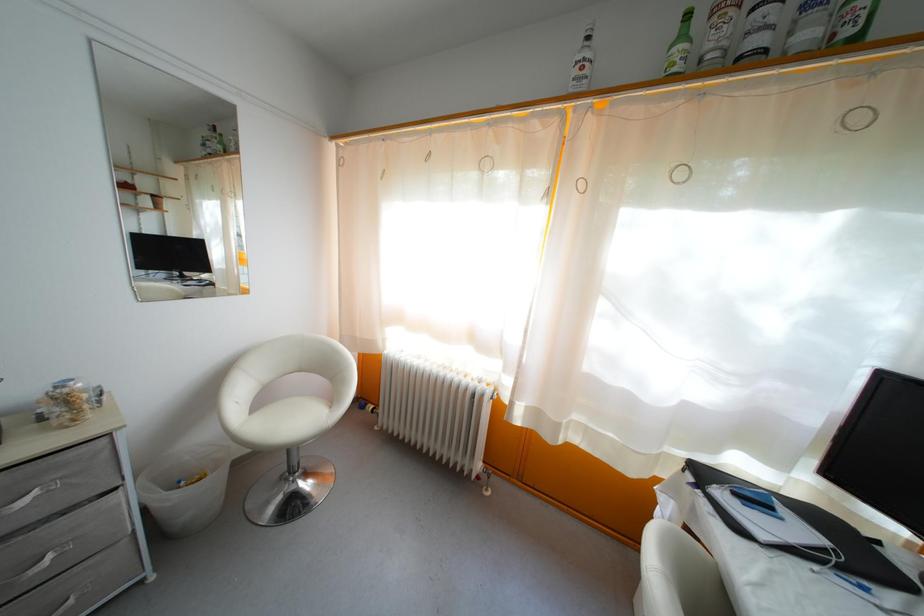
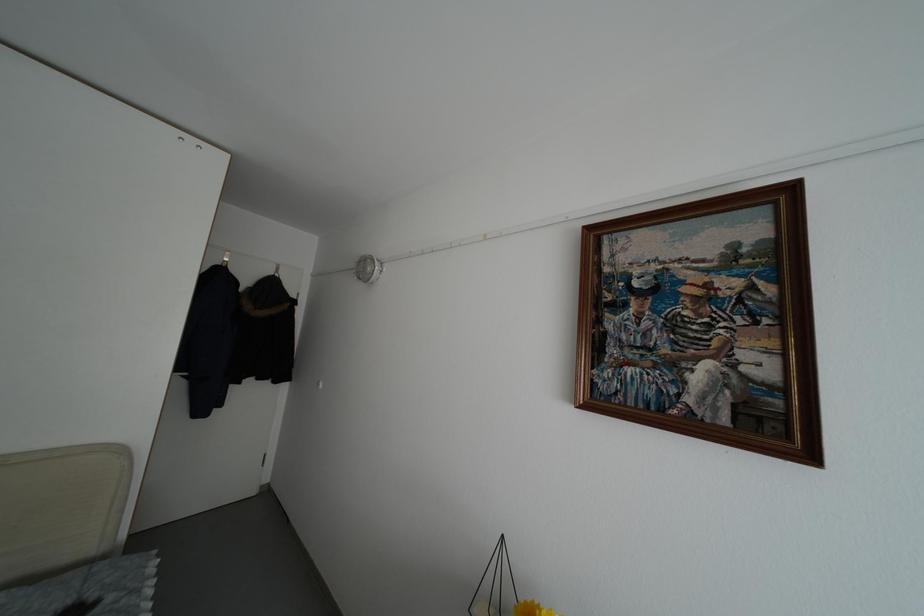
Question: The images are taken continuously from a first-person perspective. In which direction is your viewpoint rotating?

Choices:
 (A) Left
 (B) Right
 (C) Up
 (D) Down

Answer: (A)